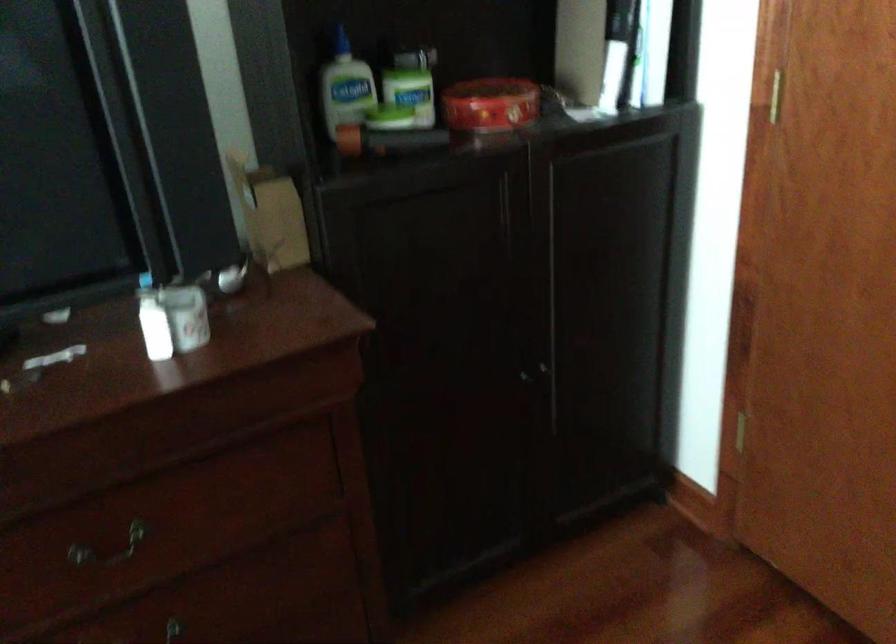
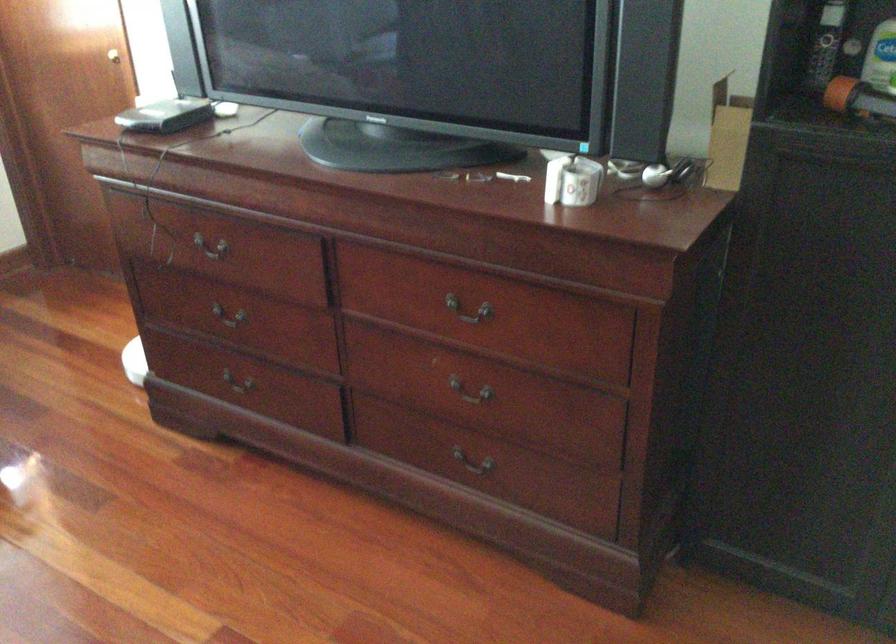
Find the pixel in the second image that matches (345,116) in the first image.

(883, 77)